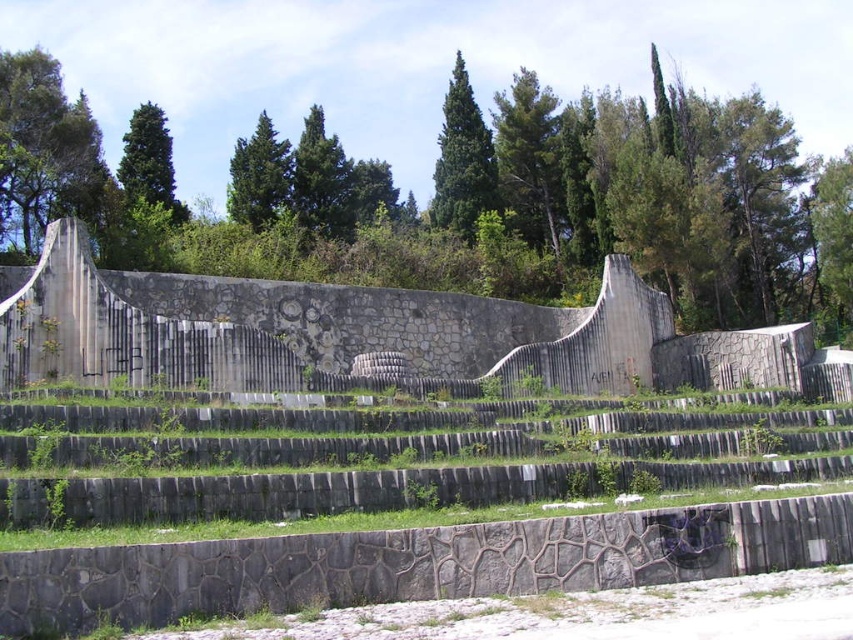
Question: Is green textured pine at center to the left of green textured tree at upper center from the viewer's perspective?

Choices:
 (A) yes
 (B) no

Answer: (B)

Question: Can you confirm if stone amphitheater at center is positioned below green textured pine at center?

Choices:
 (A) yes
 (B) no

Answer: (A)

Question: Which point is farther from the camera taking this photo?

Choices:
 (A) (165, 140)
 (B) (479, 184)
 (C) (474, 216)

Answer: (B)

Question: Which object is positioned farthest from the green textured tree at upper center?

Choices:
 (A) green textured pine at center
 (B) stone amphitheater at center
 (C) green textured pine at upper center

Answer: (B)

Question: Among these points, which one is nearest to the camera?

Choices:
 (A) (281, 186)
 (B) (474, 180)
 (C) (461, 64)

Answer: (A)

Question: Is green leafy tree at upper center below green textured tree at upper left?

Choices:
 (A) no
 (B) yes

Answer: (B)